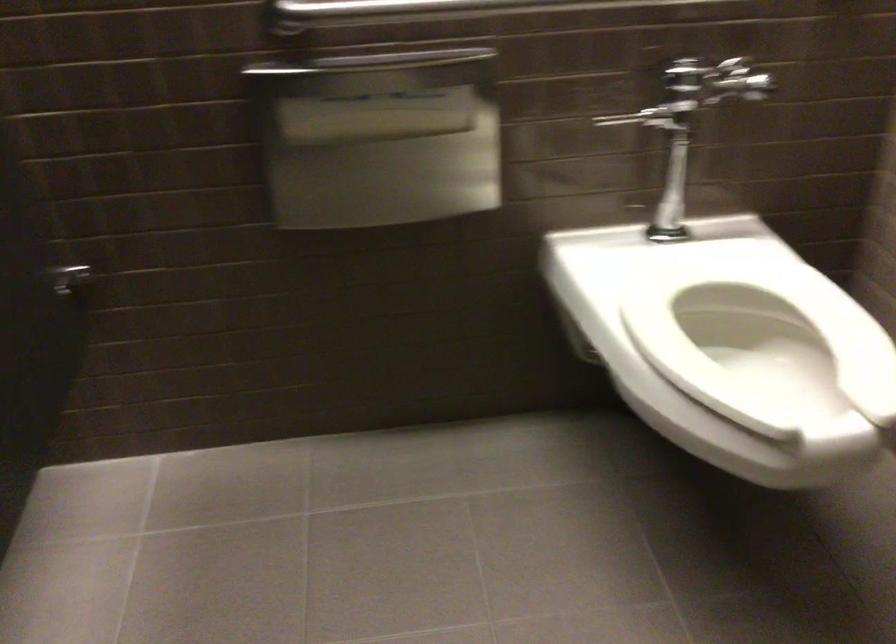
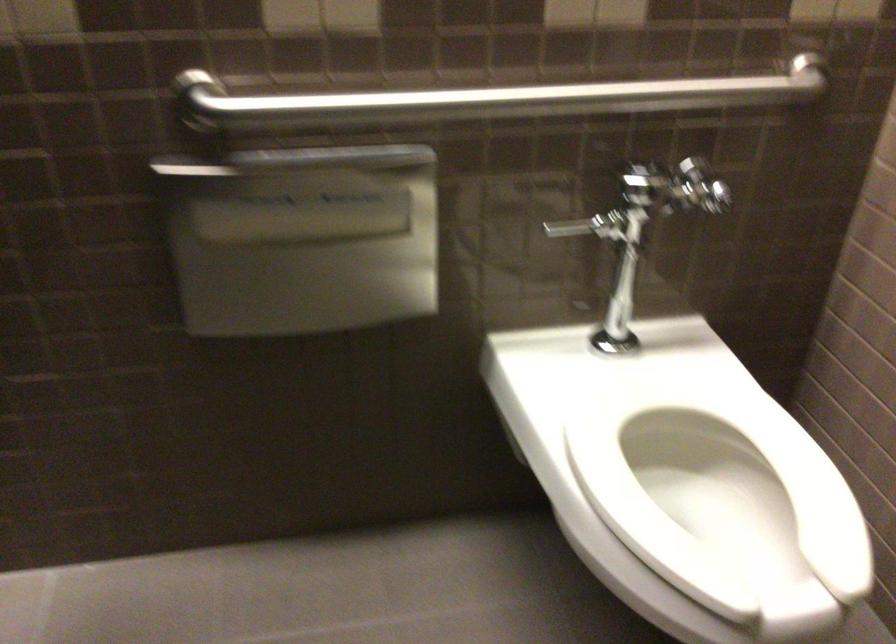
Find the pixel in the second image that matches (x=768, y=365) in the first image.

(719, 494)